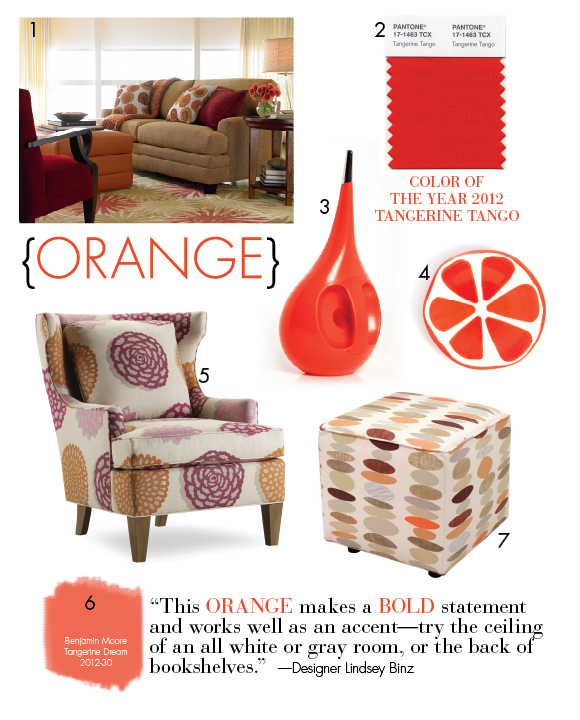
The image size is (580, 720). Identify the location of throw pillows. (153, 386), (190, 93), (217, 104), (141, 96).